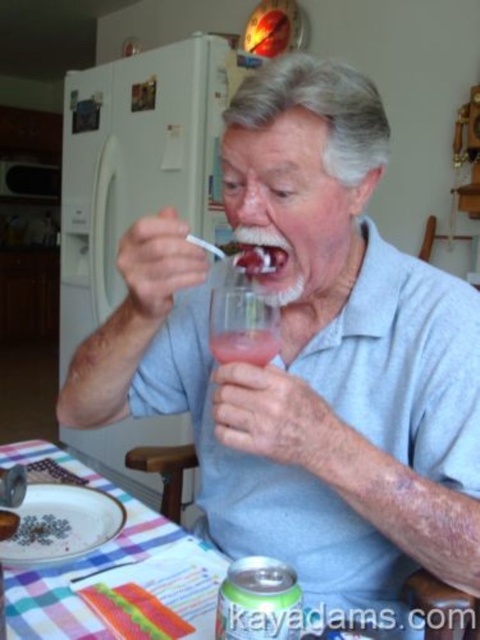
You are a delivery person who just arrived at the house. You need to place a new green metallic can at lower center on the table. Where exactly should you put it?

You should place the green metallic can at lower center at the coordinates point (259,602).

The user is designing a kitchen layout and wants to ensure that the translucent glass at lower center and the smooth red jelly at mouth can be placed on a shelf without the shorter item being hidden. Which item should be placed in front to avoid blocking the view of the other?

The smooth red jelly at mouth should be placed in front of the translucent glass at lower center since it is shorter, allowing the taller glass to be visible behind it.

The man is drinking from the translucent glass at lower center. Where is the smooth red jelly at mouth in relation to the glass?

The smooth red jelly at mouth is above the translucent glass at lower center.